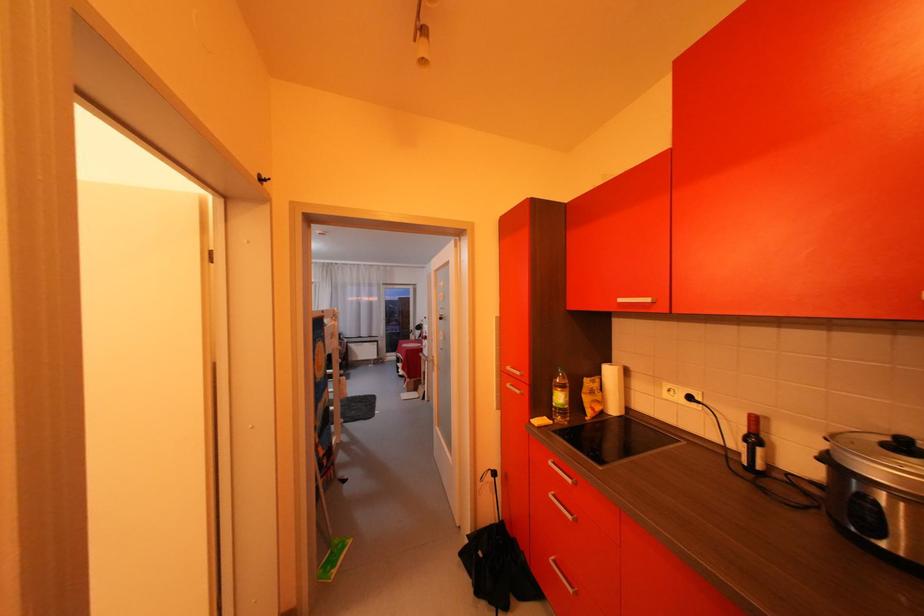
The width and height of the screenshot is (924, 616). I want to click on black electrical plug, so click(x=693, y=398).